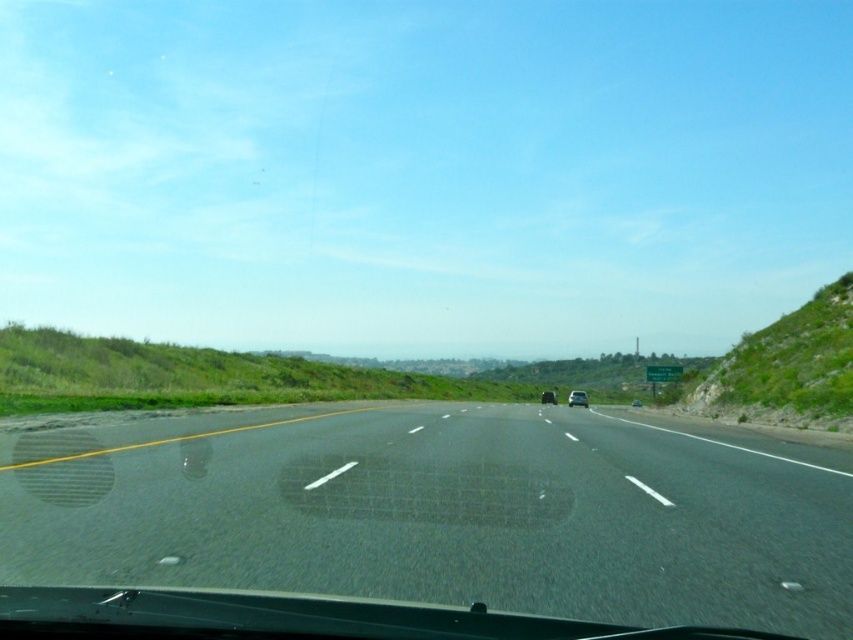
You are a passenger in the vehicle and looking out the window. You notice the green grassy hillside at right and the shiny silver sedan at center. Which object is positioned higher relative to your viewpoint?

The green grassy hillside at right is positioned higher than the shiny silver sedan at center from your viewpoint.

You are driving a car and see the silver metallic sedan at center and the shiny silver sedan at center on the highway. Which one is taller?

The silver metallic sedan at center is much taller than the shiny silver sedan at center.

You are driving a car and see two shiny silver sedan at center and silver metallic sedan at center on the road ahead. Which one is more to the right?

The silver metallic sedan at center is more to the right because it is positioned on the right side of the shiny silver sedan at center.